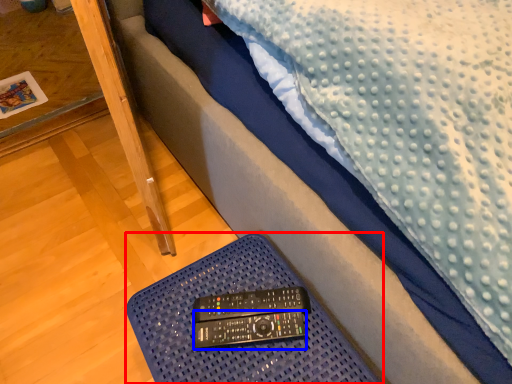
Question: Among these objects, which one is farthest to the camera, furniture (highlighted by a red box) or control (highlighted by a blue box)?

Choices:
 (A) furniture
 (B) control

Answer: (B)